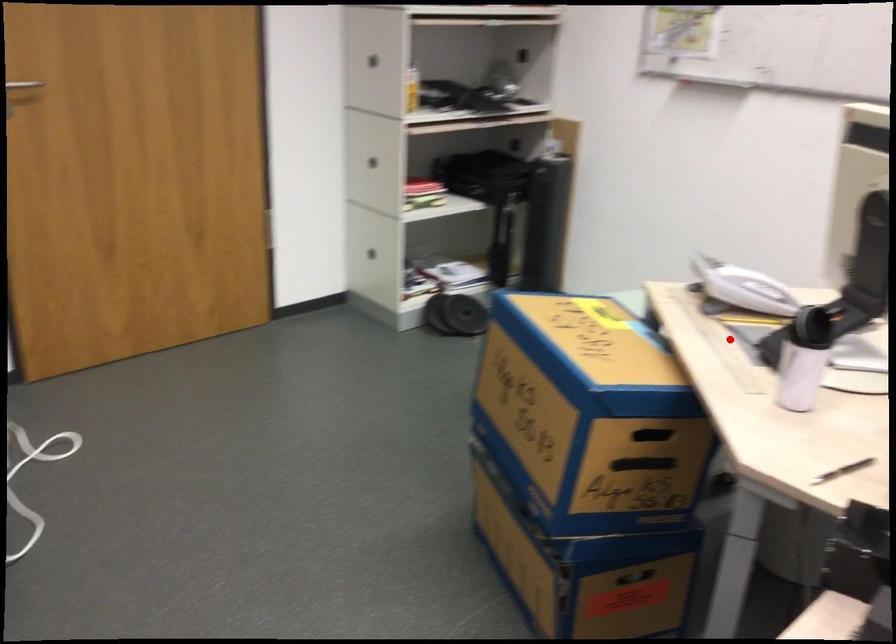
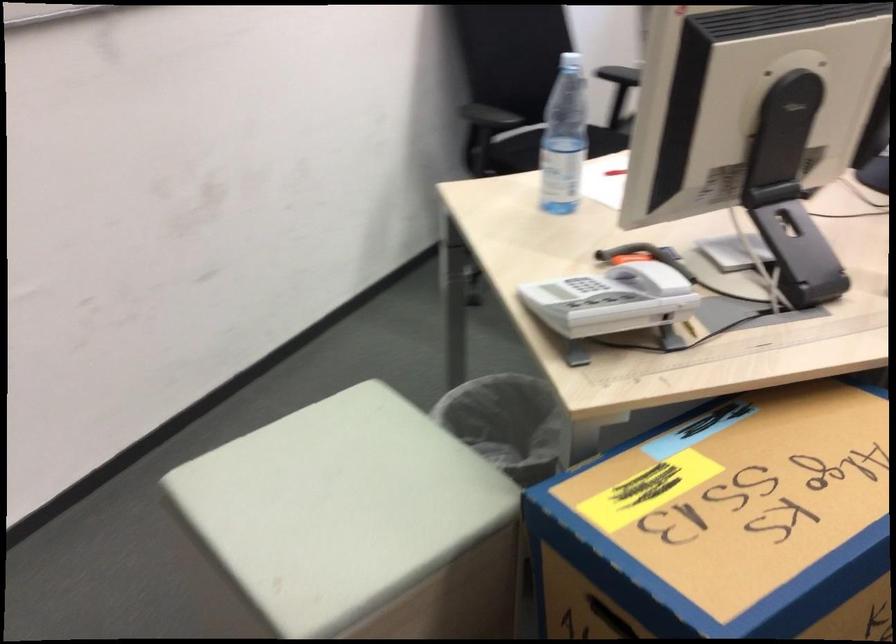
Question: A red point is marked in image1. In image2, is the corresponding 3D point closer to the camera or farther? Reply with the corresponding letter.

Choices:
 (A) The corresponding 3D point is closer.
 (B) The corresponding 3D point is farther.

Answer: (A)